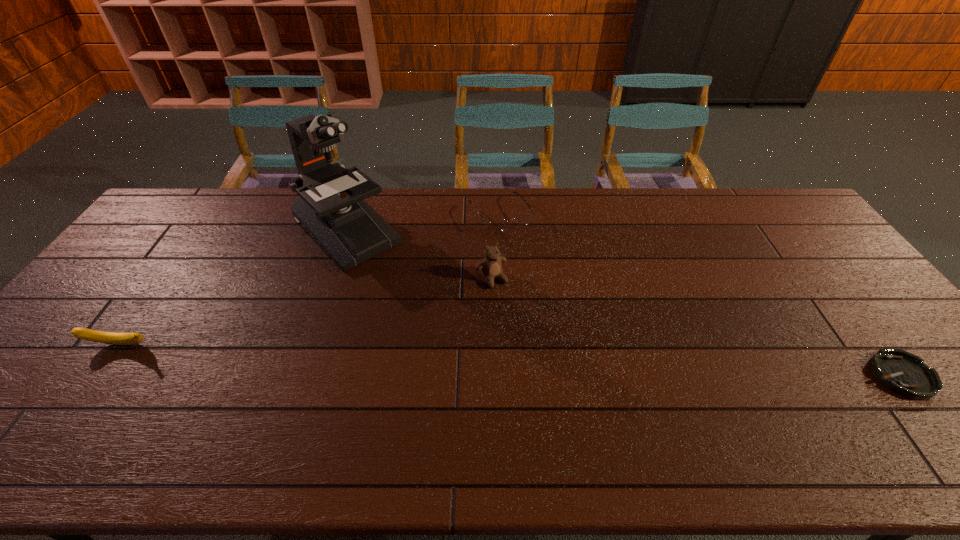
Find the location of a particular element. vacant area situated through the eyepieces of the microscope is located at coordinates (452, 333).

Where is `vacant space located 0.090m through the eyepieces of the microscope`? This screenshot has width=960, height=540. vacant space located 0.090m through the eyepieces of the microscope is located at coordinates (394, 277).

I want to click on free spot located through the eyepieces of the microscope, so click(401, 285).

You are a GUI agent. You are given a task and a screenshot of the screen. Output one action in this format:
    pyautogui.click(x=<x>, y=<y>)
    Task: Click on the vacant area located on the front-facing side of the teddy bear
    The image size is (960, 540).
    Given the screenshot: What is the action you would take?
    pyautogui.click(x=523, y=326)

Find the location of a particular element. This screenshot has height=540, width=960. vacant space located 0.230m on the front-facing side of the teddy bear is located at coordinates (539, 348).

Identify the location of free space located 0.080m on the front-facing side of the teddy bear. This screenshot has height=540, width=960. (512, 308).

This screenshot has width=960, height=540. Identify the location of free space located on the front-facing side of the second shortest object. (567, 321).

Find the location of `free location located 0.150m on the front-facing side of the second shortest object`. free location located 0.150m on the front-facing side of the second shortest object is located at coordinates (531, 264).

I want to click on free space located on the front-facing side of the second shortest object, so click(x=525, y=256).

Where is `microscope that is at the far edge`? microscope that is at the far edge is located at coordinates (330, 206).